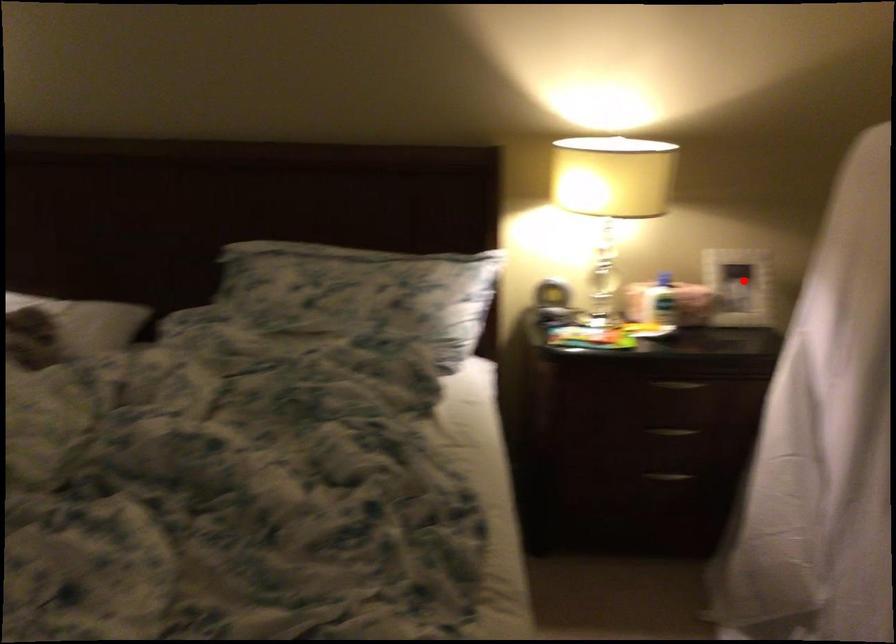
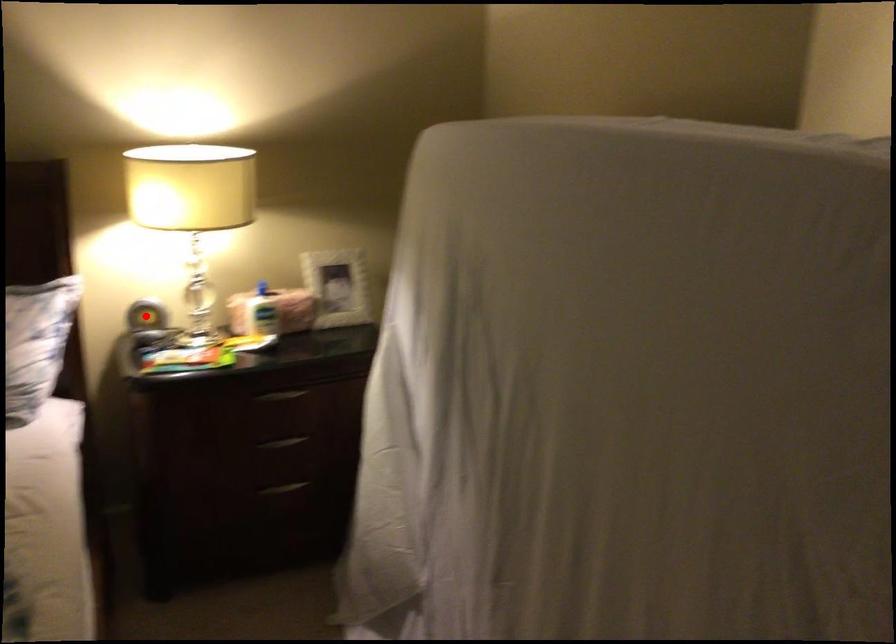
I am providing you with two images of the same scene from different viewpoints. A red point is marked on the first image and another point is marked on the second image. Do the highlighted points in image1 and image2 indicate the same real-world spot?

No